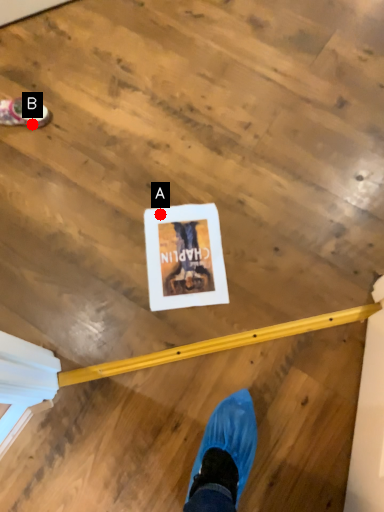
Question: Two points are circled on the image, labeled by A and B beside each circle. Which point is closer to the camera?

Choices:
 (A) A is closer
 (B) B is closer

Answer: (A)